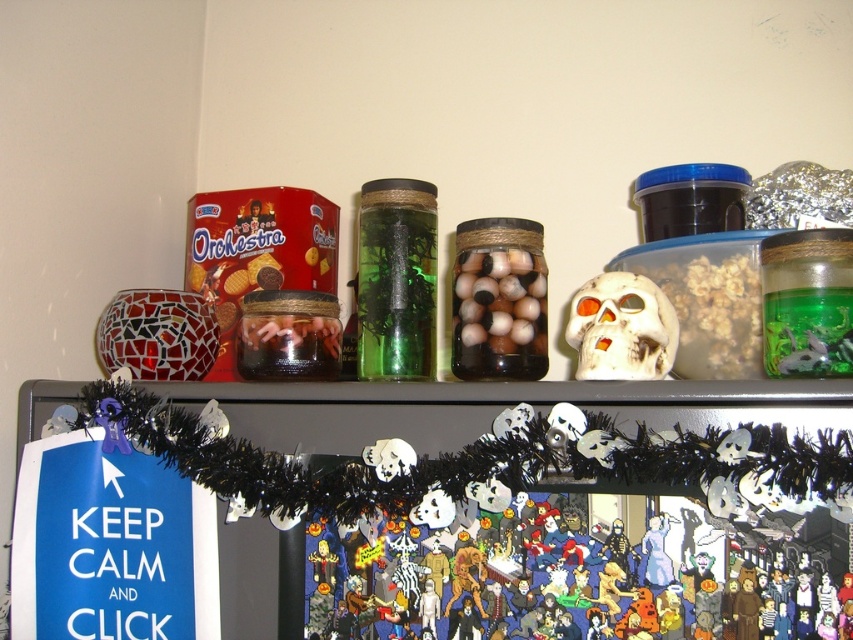
Question: Does transparent glass jar at center appear over white matte skull at center?

Choices:
 (A) no
 (B) yes

Answer: (B)

Question: Is the position of transparent glass jar at center more distant than that of translucent glass jar filled with marbles at center?

Choices:
 (A) yes
 (B) no

Answer: (A)

Question: Which point is closer to the camera taking this photo?

Choices:
 (A) (374, 362)
 (B) (659, 296)
 (C) (312, 323)

Answer: (B)

Question: Which object is the farthest from the translucent glass jar filled with marbles at center?

Choices:
 (A) transparent glass jar at center
 (B) white matte skull at center
 (C) translucent glass jar at center

Answer: (C)

Question: Among these points, which one is nearest to the camera?

Choices:
 (A) (364, 282)
 (B) (641, 276)

Answer: (B)

Question: Does translucent glass jar filled with marbles at center have a smaller size compared to translucent glass jar at center?

Choices:
 (A) no
 (B) yes

Answer: (A)